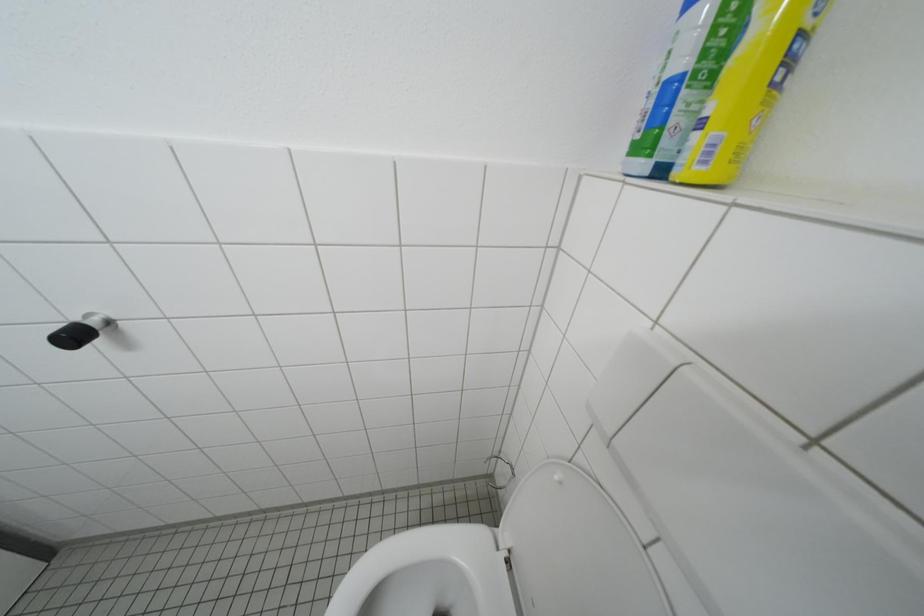
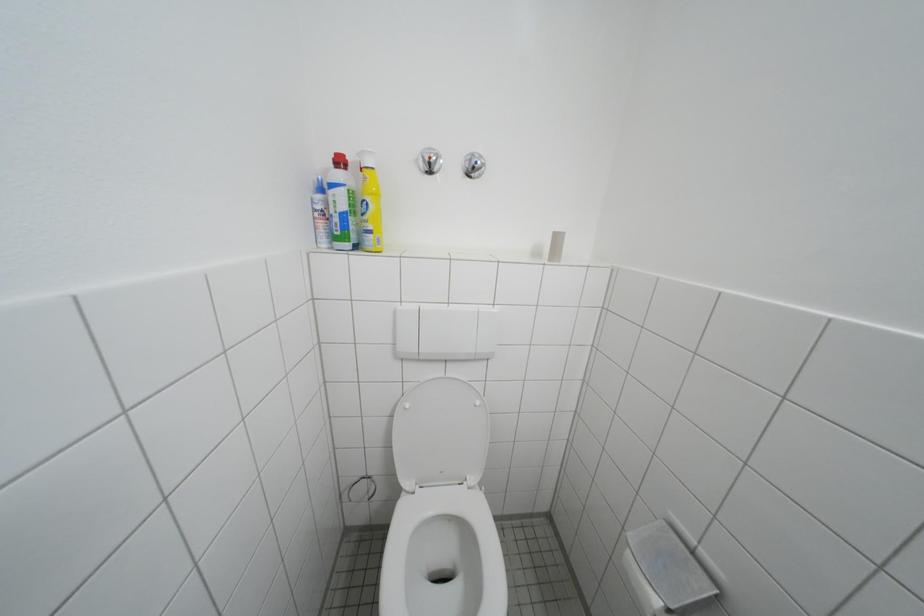
Based on the continuous images, in which direction is the camera rotating?

The rotation direction of the camera is right-down.